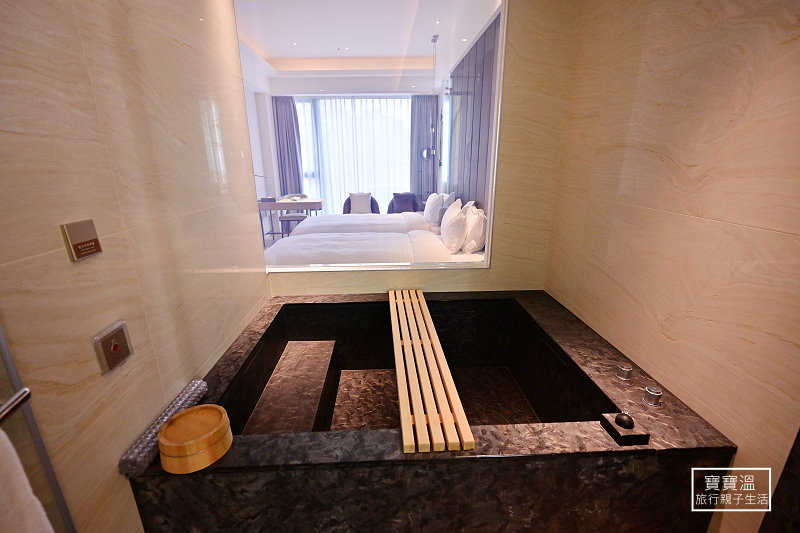
Image resolution: width=800 pixels, height=533 pixels. I want to click on white ceiling, so click(356, 15).